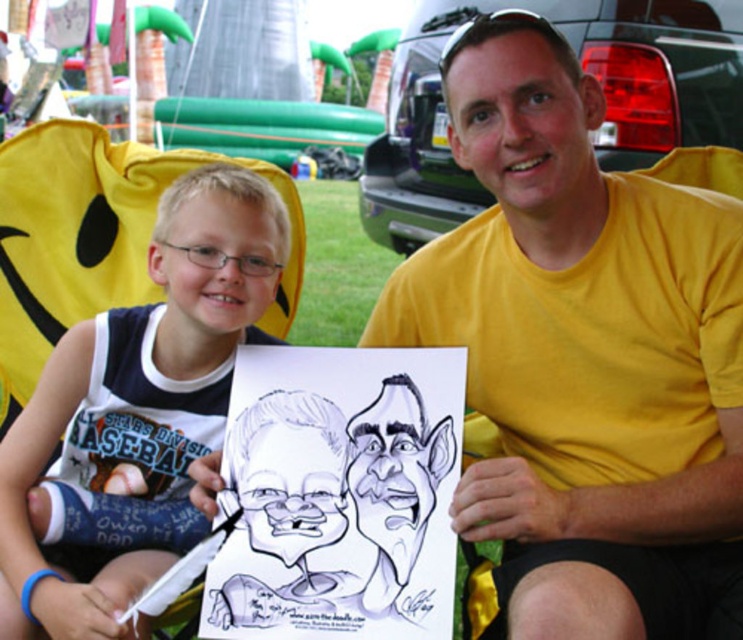
Does yellow t-shirt at center have a lesser width compared to white paper at center?

No.

At what (x,y) coordinates should I click in order to perform the action: click on yellow t-shirt at center. Please return your answer as a coordinate pair (x, y). Looking at the image, I should click on (584, 355).